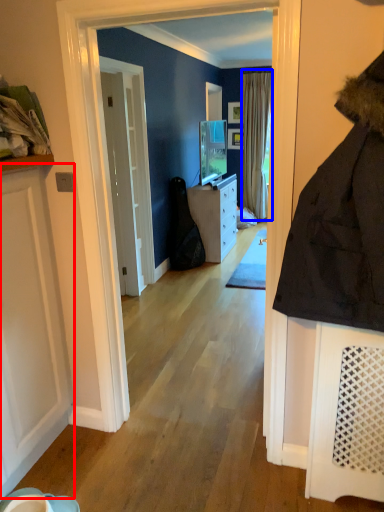
Question: Which of the following is the farthest to the observer, door (highlighted by a red box) or curtain (highlighted by a blue box)?

Choices:
 (A) door
 (B) curtain

Answer: (B)